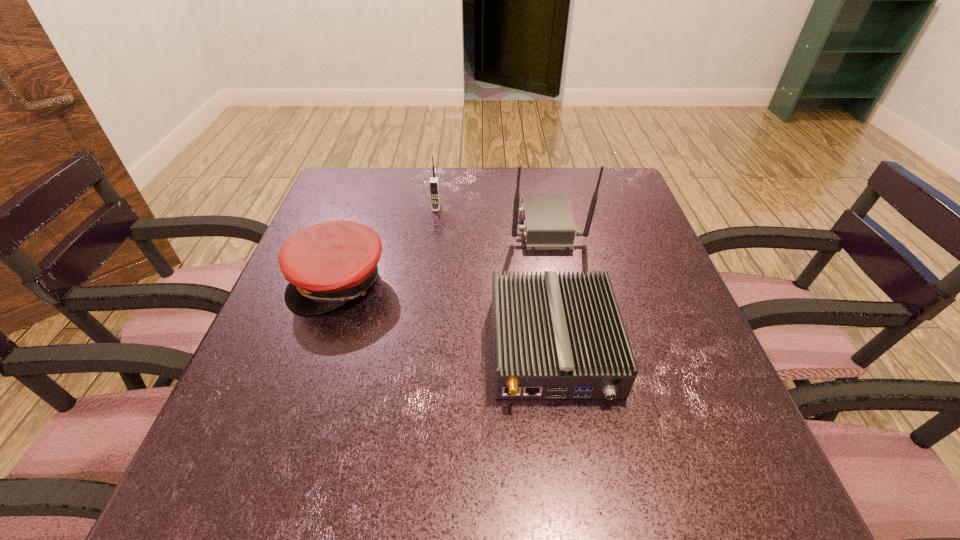
You are a GUI agent. You are given a task and a screenshot of the screen. Output one action in this format:
    pyautogui.click(x=<x>, y=<y>)
    Task: Click on the vacant space at the far right corner
    This screenshot has width=960, height=540.
    Given the screenshot: What is the action you would take?
    pyautogui.click(x=572, y=168)

What are the coordinates of `vacant area that lies between the taller router and the third shortest object` in the screenshot? It's located at (492, 217).

Find the location of a particular element. The height and width of the screenshot is (540, 960). vacant space in between the third object from right to left and the leftmost object is located at coordinates (388, 245).

Where is `free space between the leftmost object and the shortest object`? free space between the leftmost object and the shortest object is located at coordinates coord(446,314).

The width and height of the screenshot is (960, 540). I want to click on vacant space in between the leftmost object and the second tallest object, so click(388, 245).

Identify the location of vacant region between the tallest object and the cellular telephone. The height and width of the screenshot is (540, 960). (492, 217).

The height and width of the screenshot is (540, 960). In order to click on empty space between the shortest object and the leftmost object in this screenshot , I will do `click(446, 314)`.

Locate which object ranks second in proximity to the second object from left to right. Please provide its 2D coordinates. Your answer should be formatted as a tuple, i.e. [(x, y)], where the tuple contains the x and y coordinates of a point satisfying the conditions above.

[(548, 222)]

Find the location of a particular element. Image resolution: width=960 pixels, height=540 pixels. object that is the second closest to the shortest object is located at coordinates (327, 265).

Locate an element on the screen. This screenshot has width=960, height=540. free region that satisfies the following two spatial constraints: 1. on the back of the taller router to connect cables; 2. on the front-facing side of the cap is located at coordinates (x=556, y=281).